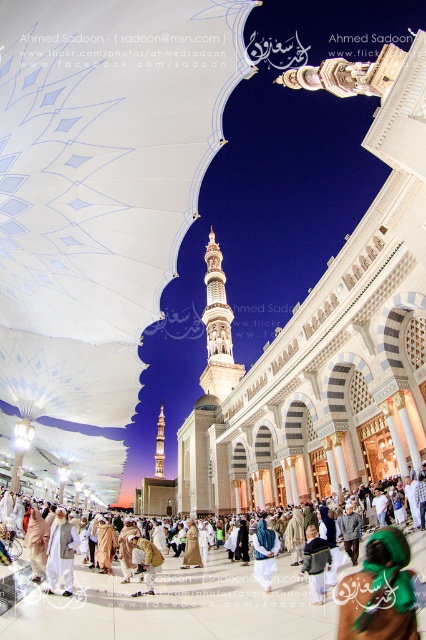
Question: Is blue fabric headscarf at center thinner than golden fabric robe at center?

Choices:
 (A) no
 (B) yes

Answer: (B)

Question: Which point is farther to the camera?

Choices:
 (A) (52, 570)
 (B) (397, 548)
 (C) (192, 563)

Answer: (C)

Question: Considering the relative positions of white fabric canopy at center and dark blue fabric at center in the image provided, where is white fabric canopy at center located with respect to dark blue fabric at center?

Choices:
 (A) right
 (B) left

Answer: (B)

Question: Is green fabric headscarf at lower right smaller than golden fabric robe at center?

Choices:
 (A) yes
 (B) no

Answer: (B)

Question: Estimate the real-world distances between objects in this image. Which object is closer to the green fabric headscarf at lower right?

Choices:
 (A) white fabric canopy at center
 (B) blue fabric headscarf at center
 (C) golden fabric robe at center

Answer: (B)

Question: Among these objects, which one is farthest from the camera?

Choices:
 (A) green fabric headscarf at lower right
 (B) white marble minaret at center
 (C) golden fabric robe at center

Answer: (B)